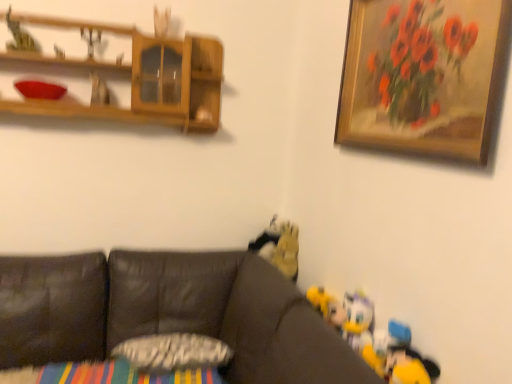
Question: Visually, is wooden framed painting at upper right positioned to the left or to the right of matte plastic toy at upper left, the second toy viewed from the left?

Choices:
 (A) left
 (B) right

Answer: (B)

Question: Do you think wooden framed painting at upper right is within matte plastic toy at upper left, placed as the 5th toy when sorted from right to left, or outside of it?

Choices:
 (A) inside
 (B) outside

Answer: (B)

Question: Estimate the real-world distances between objects in this image. Which object is closer to the wooden shelf at upper left?

Choices:
 (A) green felt toy at upper left, which appears as the 6th toy when ordered from the bottom
 (B) wooden framed painting at upper right
 (C) matte plastic toy at upper left, placed as the 5th toy when sorted from right to left
 (D) textured gray pillow at center
 (E) yellow plush toy at lower right, the 6th toy positioned from the top

Answer: (C)

Question: Which of these objects is positioned farthest from the metallic silver toy at upper left, the 3th toy in the top-to-bottom sequence?

Choices:
 (A) green felt toy at upper left, acting as the first toy starting from the left
 (B) brown leather couch at lower left
 (C) plush yellow duck at lower right, which is the fifth toy from top to bottom
 (D) wooden shelf at upper left
 (E) textured gray pillow at center

Answer: (C)